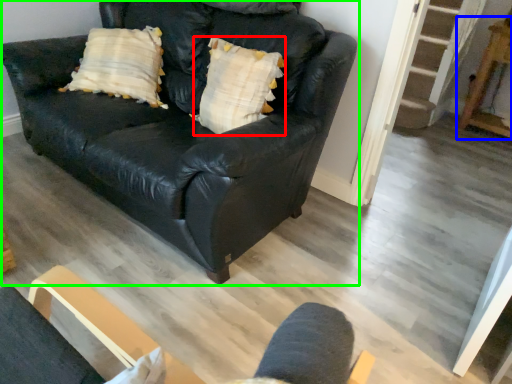
Question: Which object is the closest to the pillow (highlighted by a red box)? Choose among these: table (highlighted by a blue box) or studio couch (highlighted by a green box).

Choices:
 (A) table
 (B) studio couch

Answer: (B)